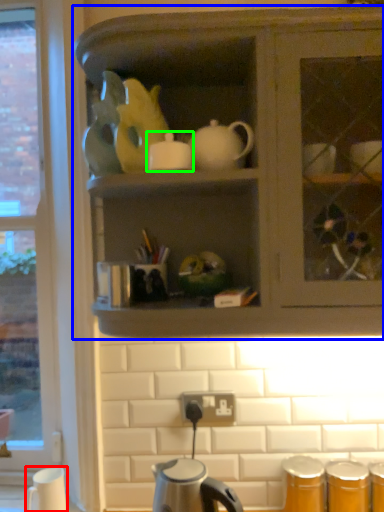
Question: Which object is the farthest from coffee cup (highlighted by a red box)? Choose among these: cabinetry (highlighted by a blue box) or tableware (highlighted by a green box).

Choices:
 (A) cabinetry
 (B) tableware

Answer: (A)